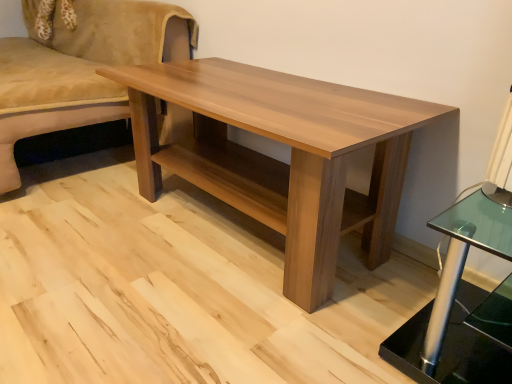
The image size is (512, 384). Find the location of `blank space situated above light brown wood coffee table at center (from a real-world perspective)`. blank space situated above light brown wood coffee table at center (from a real-world perspective) is located at coordinates (261, 88).